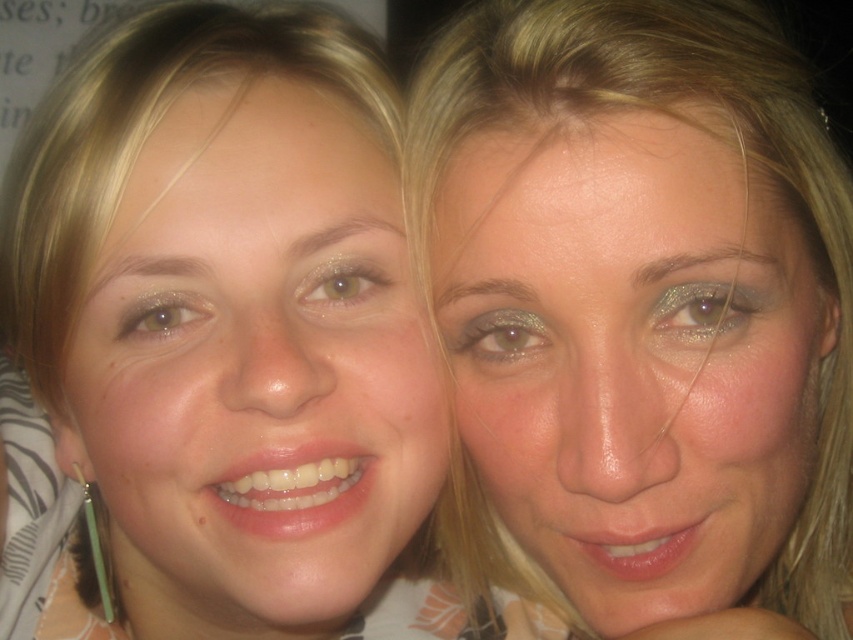
Is point (422, 385) closer to viewer compared to point (650, 372)?

No, it is behind (650, 372).

Can you confirm if smooth skin face at center is bigger than matte skin face at center?

Indeed, smooth skin face at center has a larger size compared to matte skin face at center.

Between point (294, 376) and point (648, 593), which one is positioned in front?

Point (294, 376) is in front.

The height and width of the screenshot is (640, 853). I want to click on smooth skin face at center, so click(x=213, y=337).